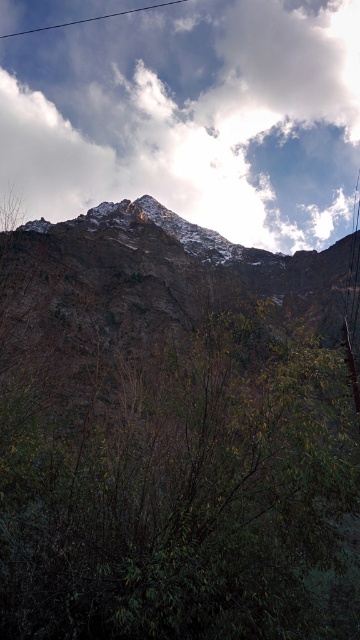
Between green leafy tree at center and rugged stone mountain range at center, which one is positioned higher?

rugged stone mountain range at center

Can you confirm if green leafy tree at center is wider than rugged stone mountain range at center?

No.

Between point (326, 401) and point (6, 349), which one is positioned behind?

The point (6, 349) is behind.

The image size is (360, 640). Identify the location of green leafy tree at center. (181, 488).

Can you confirm if green leafy tree at center is positioned to the right of white fluffy cloud at upper center?

Indeed, green leafy tree at center is positioned on the right side of white fluffy cloud at upper center.

Who is more distant from viewer, (263, 547) or (276, 29)?

The point (276, 29) is behind.

This screenshot has width=360, height=640. What are the coordinates of `green leafy tree at center` in the screenshot? It's located at (181, 488).

Is white fluffy cloud at upper center thinner than rugged stone mountain range at center?

No.

Does point (251, 170) come farther from viewer compared to point (79, 317)?

Yes.

At what (x,y) coordinates should I click in order to perform the action: click on white fluffy cloud at upper center. Please return your answer as a coordinate pair (x, y). The height and width of the screenshot is (640, 360). Looking at the image, I should click on (192, 116).